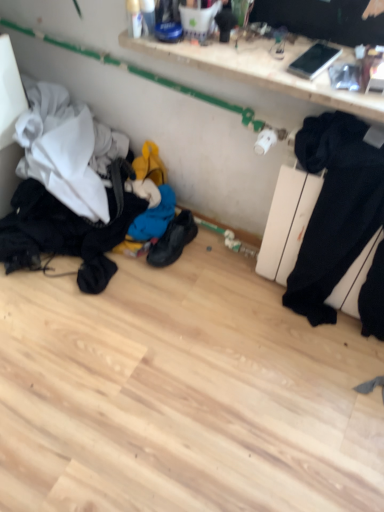
This screenshot has height=512, width=384. Find the location of `free space in front of black leather shoes at center`. free space in front of black leather shoes at center is located at coordinates (177, 287).